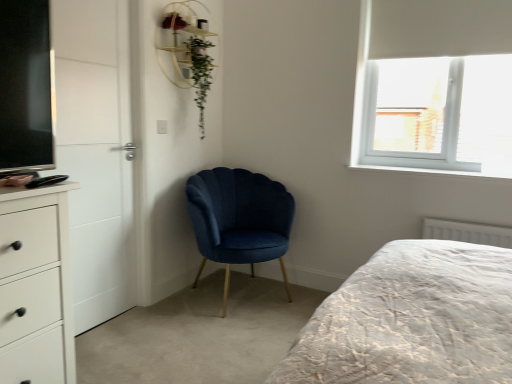
Question: Visually, is velvet blue chair at center positioned to the left or to the right of green leafy plant at upper center?

Choices:
 (A) right
 (B) left

Answer: (A)

Question: Is velvet blue chair at center bigger or smaller than green leafy plant at upper center?

Choices:
 (A) big
 (B) small

Answer: (A)

Question: Which object is positioned closest to the white matte chest of drawers at left?

Choices:
 (A) white textured radiator at lower right
 (B) white plastic window at upper right
 (C) green leafy plant at upper center
 (D) wooden shelf at upper center
 (E) velvet blue chair at center

Answer: (E)

Question: Which of these objects is positioned farthest from the wooden shelf at upper center?

Choices:
 (A) green leafy plant at upper center
 (B) white matte chest of drawers at left
 (C) white textured radiator at lower right
 (D) velvet blue chair at center
 (E) white plastic window at upper right

Answer: (C)